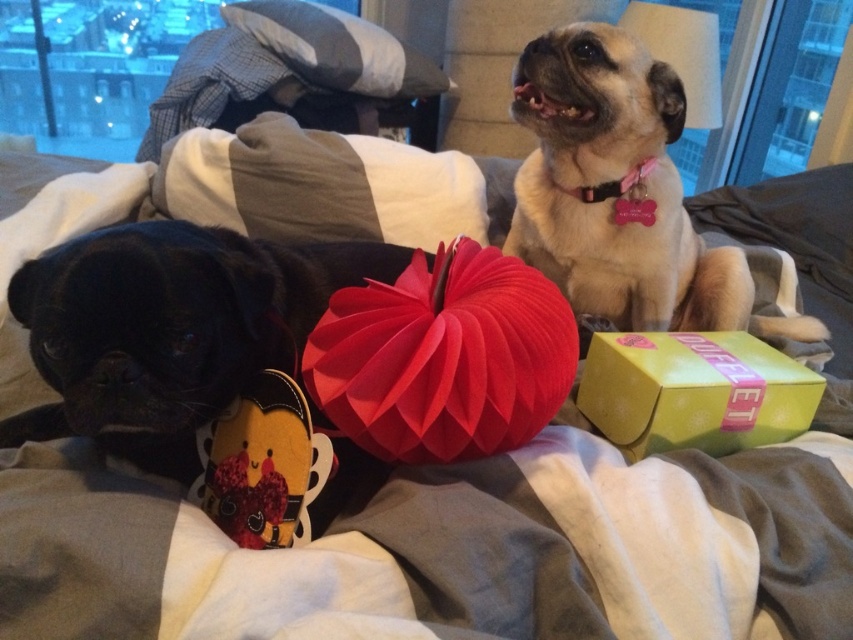
In the scene shown: Who is shorter, light brown fur at upper right or gray/white striped pillow at upper center?

Standing shorter between the two is gray/white striped pillow at upper center.

Is light brown fur at upper right to the right of gray/white striped pillow at upper center from the viewer's perspective?

Indeed, light brown fur at upper right is positioned on the right side of gray/white striped pillow at upper center.

Which is behind, point (599, 180) or point (293, 29)?

The point (293, 29) is more distant.

Find the location of a particular element. Image resolution: width=853 pixels, height=640 pixels. light brown fur at upper right is located at coordinates (619, 193).

Is green matte gift box at center right in front of gray/white striped pillow at upper center?

Yes, it is.

Does point (686, 371) come in front of point (296, 72)?

Yes.

Where is `green matte gift box at center right`? green matte gift box at center right is located at coordinates (693, 392).

Does white soft pillow at center appear on the right side of green matte gift box at center right?

Incorrect, white soft pillow at center is not on the right side of green matte gift box at center right.

What do you see at coordinates (318, 186) in the screenshot? I see `white soft pillow at center` at bounding box center [318, 186].

Identify the location of white soft pillow at center. The width and height of the screenshot is (853, 640). (318, 186).